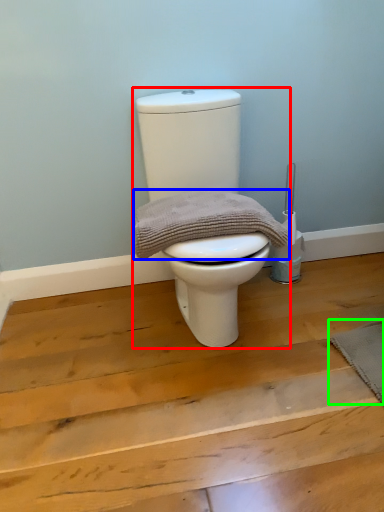
Question: Which object is the farthest from toilet (highlighted by a red box)? Choose among these: material (highlighted by a blue box) or doormat (highlighted by a green box).

Choices:
 (A) material
 (B) doormat

Answer: (B)